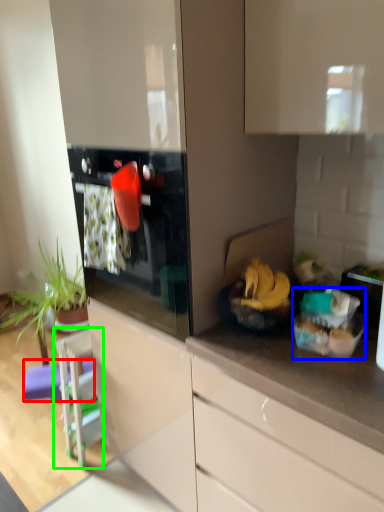
Question: Which object is positioned farthest from bar stool (highlighted by a red box)? Select from food (highlighted by a blue box) and appliance (highlighted by a green box).

Choices:
 (A) food
 (B) appliance

Answer: (A)